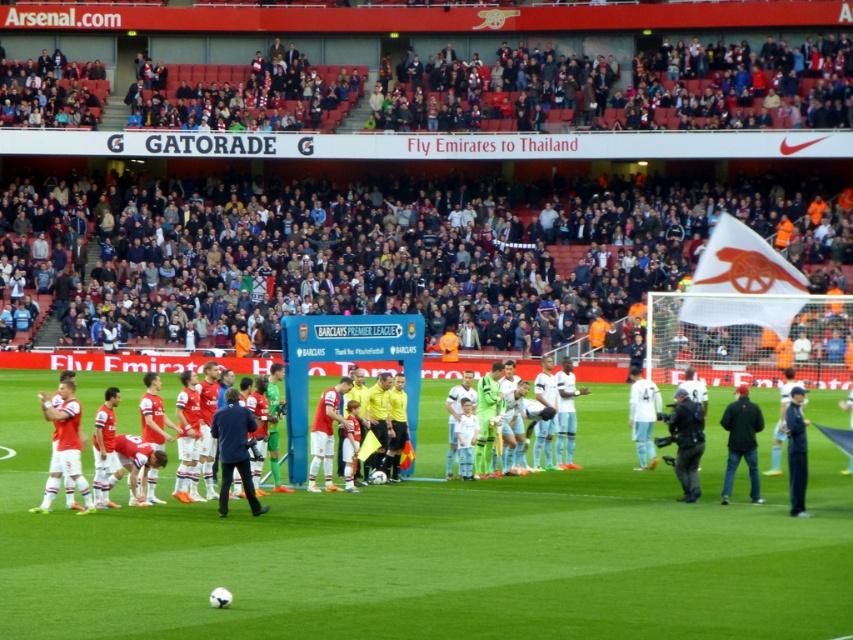
Question: Which object appears closest to the camera in this image?

Choices:
 (A) white fabric flag at right
 (B) white fabric crowd at upper center
 (C) green grass at center
 (D) white jersey at left

Answer: (C)

Question: Among these objects, which one is nearest to the camera?

Choices:
 (A) white jersey at left
 (B) white fabric flag at right
 (C) white fabric crowd at upper center
 (D) green grass at center

Answer: (D)

Question: Does green grass at center have a larger size compared to white fabric crowd at upper center?

Choices:
 (A) no
 (B) yes

Answer: (A)

Question: Considering the relative positions of white fabric flag at right and white jersey at left in the image provided, where is white fabric flag at right located with respect to white jersey at left?

Choices:
 (A) left
 (B) right

Answer: (B)

Question: Estimate the real-world distances between objects in this image. Which object is closer to the green grass at center?

Choices:
 (A) white jersey at left
 (B) white fabric flag at right

Answer: (A)

Question: Is white fabric crowd at upper center thinner than white jersey at left?

Choices:
 (A) yes
 (B) no

Answer: (B)